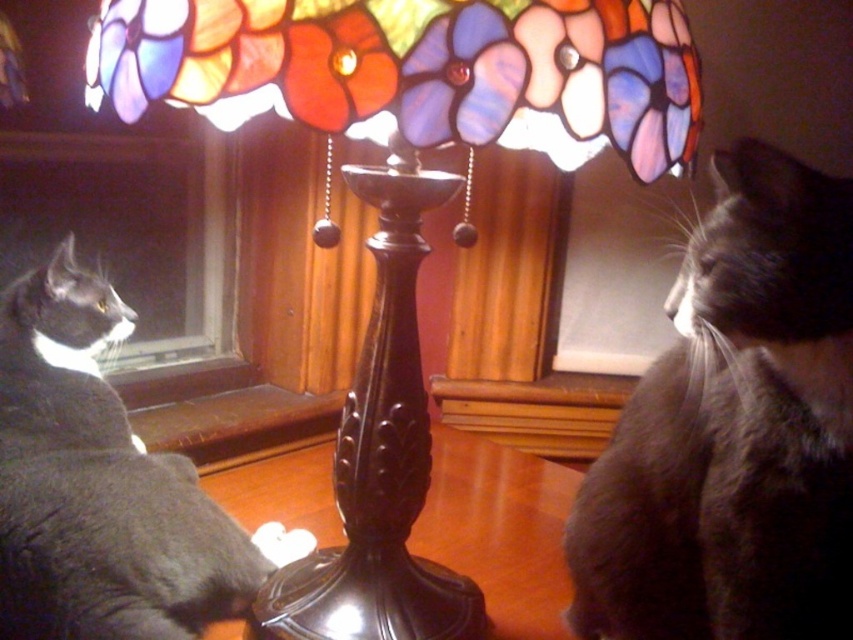
You are an interior designer planning to hang a new painting. The painting is 1 meter wide and needs to be placed exactly where the stained glass lampshade at center is currently located. Is there enough space to hang the painting without overlapping the lampshade?

The stained glass lampshade at center is located at point [416,77]. Since the painting is 1 meter wide and the lampshade is at a specific point, there is insufficient space to hang the painting without overlapping the lampshade.